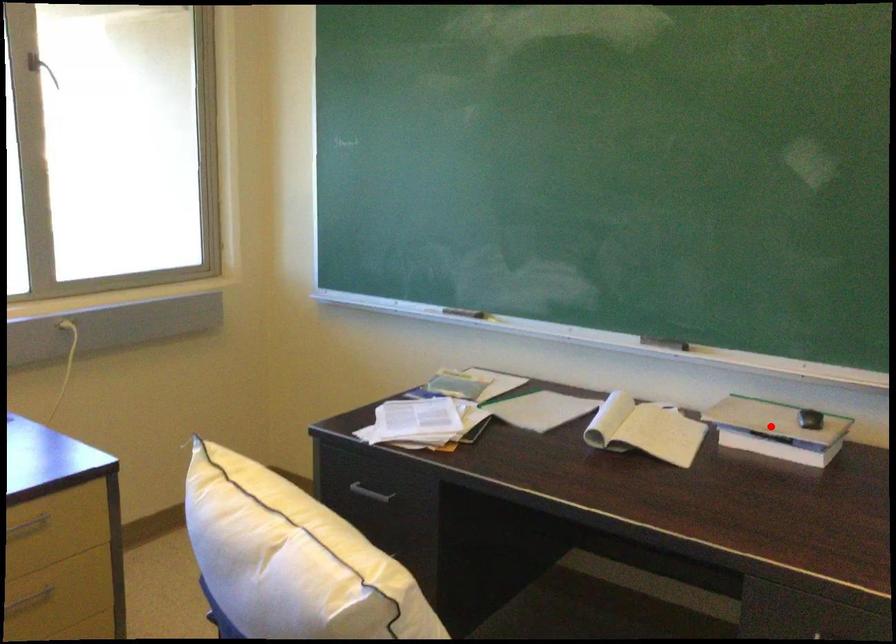
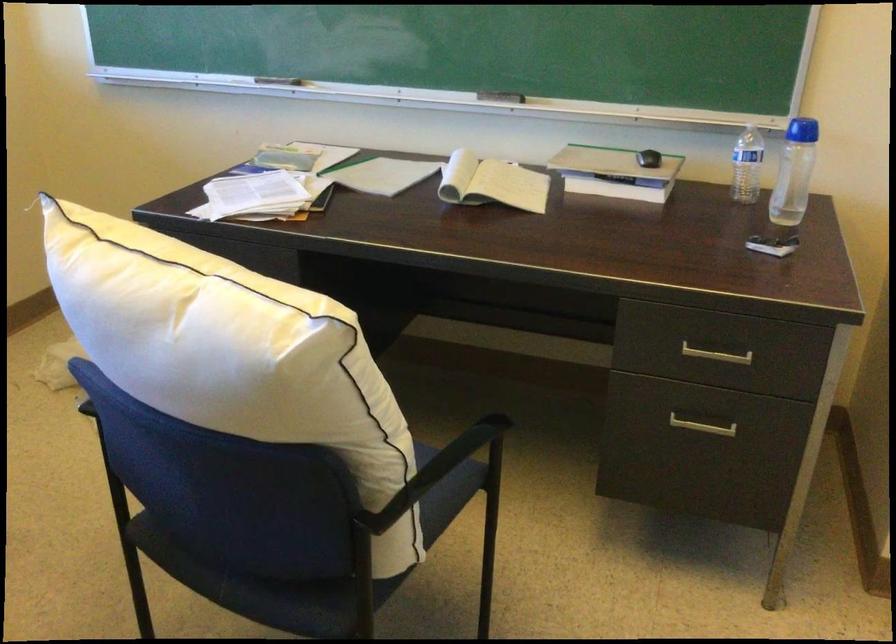
The point at the highlighted location is marked in the first image. Where is the corresponding point in the second image?

(615, 173)